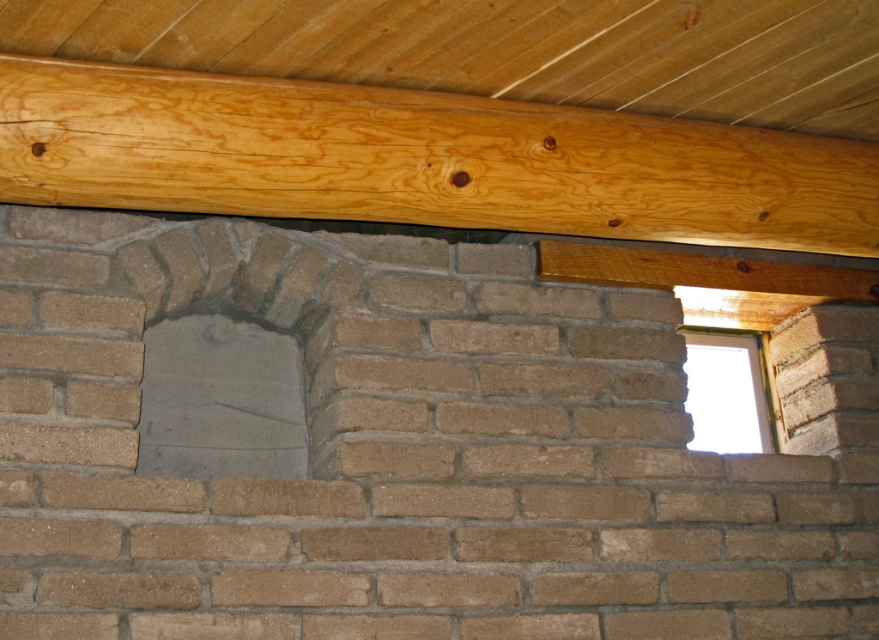
Which is above, gray concrete hole at center or transparent glass window at upper right?

gray concrete hole at center

Is gray concrete hole at center positioned before transparent glass window at upper right?

Yes, it is.

Which is in front, point (175, 369) or point (723, 337)?

Positioned in front is point (175, 369).

Locate an element on the screen. This screenshot has height=640, width=879. gray concrete hole at center is located at coordinates (220, 401).

Can you confirm if natural wood beam at upper center is positioned below transparent glass window at upper right?

No.

Between point (476, 163) and point (738, 436), which one is positioned in front?

Point (476, 163) is more forward.

Locate an element on the screen. This screenshot has width=879, height=640. natural wood beam at upper center is located at coordinates (420, 160).

Can you confirm if natural wood beam at upper center is positioned to the right of gray concrete hole at center?

Indeed, natural wood beam at upper center is positioned on the right side of gray concrete hole at center.

Does natural wood beam at upper center lie behind gray concrete hole at center?

No.

Which is behind, point (169, 99) or point (189, 435)?

Positioned behind is point (189, 435).

I want to click on natural wood beam at upper center, so click(420, 160).